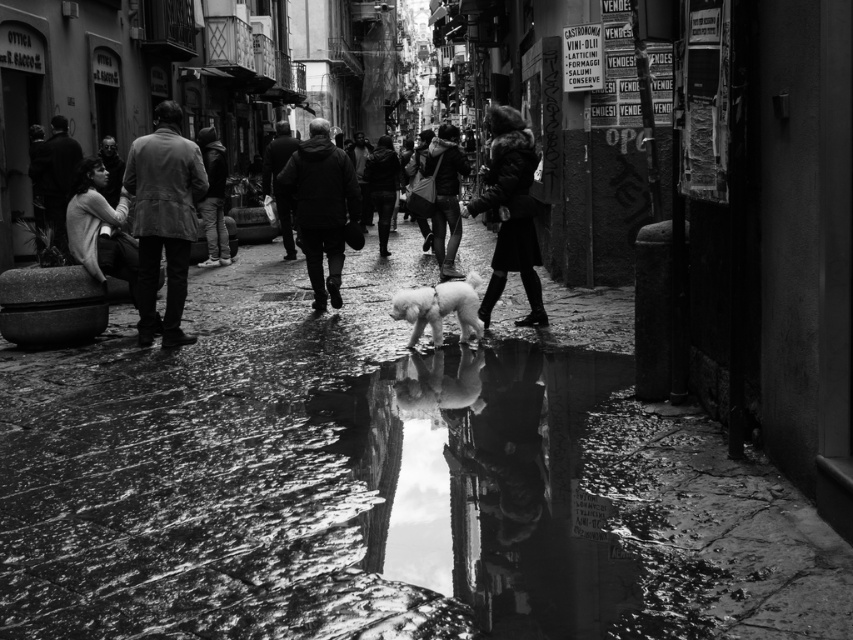
You are a fashion designer observing a street scene. You notice two garments at the center of the image. Which one is positioned lower between the dark matte coat at center and the leather jacket at center?

The dark matte coat at center is positioned lower than the leather jacket at center.

You are a photographer standing in the middle of the wet cobblestone street in the bustling black and white scene. You want to capture the leather jacket at left in your shot. Which direction should you move to ensure it appears centered in your viewfinder?

Since the leather jacket at left is located at point (163,220), you should move to your right to center it in your viewfinder.